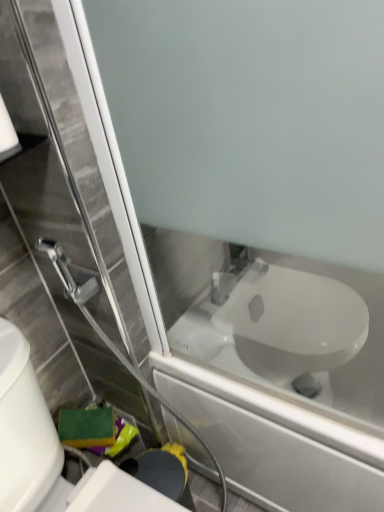
Find the location of a particular element. The image size is (384, 512). white glossy toilet at center is located at coordinates (277, 372).

Looking at this image, from the image's perspective, which one is positioned lower, white glossy toilet at lower right or white matte toilet paper at upper left?

white glossy toilet at lower right, from the image's perspective.

Relative to white matte toilet paper at upper left, is white glossy toilet at lower right in front or behind?

In the image, white glossy toilet at lower right appears in front of white matte toilet paper at upper left.

Is white glossy toilet at lower right inside or outside of white matte toilet paper at upper left?

white glossy toilet at lower right exists outside the volume of white matte toilet paper at upper left.

Is point (254, 440) positioned in front of point (28, 348)?

No, (254, 440) is behind (28, 348).

From a real-world perspective, is white glossy toilet at center physically above white glossy toilet at lower right?

Incorrect, from a real-world perspective, white glossy toilet at center is lower than white glossy toilet at lower right.

Consider the image. Which object is positioned more to the right, white glossy toilet at center or white glossy toilet at lower right?

white glossy toilet at center is more to the right.

From the image's perspective, who appears lower, white glossy toilet at center or white glossy toilet at lower right?

white glossy toilet at lower right is shown below in the image.

From a real-world perspective, is white matte toilet paper at upper left on top of white glossy toilet at lower right?

Indeed, from a real-world perspective, white matte toilet paper at upper left stands above white glossy toilet at lower right.

From the image's perspective, is white matte toilet paper at upper left positioned above or below white glossy toilet at lower right?

Based on their image positions, white matte toilet paper at upper left is located above white glossy toilet at lower right.

Does point (7, 136) come in front of point (108, 477)?

Yes, it is in front of point (108, 477).

From the image's perspective, relative to white matte toilet paper at upper left, is white glossy toilet at center above or below?

Based on their image positions, white glossy toilet at center is located beneath white matte toilet paper at upper left.

Is white glossy toilet at center in front of or behind white matte toilet paper at upper left in the image?

Visually, white glossy toilet at center is located behind white matte toilet paper at upper left.

Can you tell me how much white glossy toilet at center and white matte toilet paper at upper left differ in facing direction?

90.5 degrees separate the facing orientations of white glossy toilet at center and white matte toilet paper at upper left.

From a real-world perspective, relative to white glossy toilet at center, is white matte toilet paper at upper left vertically above or below?

In terms of real-world spatial position, white matte toilet paper at upper left is above white glossy toilet at center.

Between point (12, 124) and point (181, 326), which one is positioned behind?

Point (181, 326)

How many degrees apart are the facing directions of white matte toilet paper at upper left and white glossy toilet at center?

The facing directions of white matte toilet paper at upper left and white glossy toilet at center are 90.5 degrees apart.

Considering the relative positions of white matte toilet paper at upper left and white glossy toilet at center in the image provided, is white matte toilet paper at upper left to the right of white glossy toilet at center from the viewer's perspective?

No.

From a real-world perspective, who is located lower, white glossy toilet at lower right or white glossy toilet at center?

white glossy toilet at center, from a real-world perspective.

Considering the relative sizes of white glossy toilet at lower right and white glossy toilet at center in the image provided, is white glossy toilet at lower right bigger than white glossy toilet at center?

No, white glossy toilet at lower right is not bigger than white glossy toilet at center.

Based on the photo, which object is wider, white glossy toilet at lower right or white glossy toilet at center?

With larger width is white glossy toilet at center.

Is white glossy toilet at lower right aimed at white glossy toilet at center?

No, white glossy toilet at lower right is not oriented towards white glossy toilet at center.

Find the location of a particular element. The height and width of the screenshot is (512, 384). toilet paper that is behind the white glossy toilet at lower right is located at coordinates (6, 129).

I want to click on toilet in front of the white glossy toilet at center, so click(x=52, y=450).

Estimate the real-world distances between objects in this image. Which object is closer to white glossy toilet at lower right, white glossy toilet at center or white matte toilet paper at upper left?

white glossy toilet at center.

When comparing their distances from white glossy toilet at center, does white glossy toilet at lower right or white matte toilet paper at upper left seem closer?

white glossy toilet at lower right is closer to white glossy toilet at center.

Looking at the image, which one is located closer to white matte toilet paper at upper left, white glossy toilet at lower right or white glossy toilet at center?

→ white glossy toilet at lower right is positioned closer to the anchor white matte toilet paper at upper left.

When comparing their distances from white matte toilet paper at upper left, does white glossy toilet at center or white glossy toilet at lower right seem further?

Based on the image, white glossy toilet at center appears to be further to white matte toilet paper at upper left.

Looking at the image, which one is located further to white glossy toilet at center, white matte toilet paper at upper left or white glossy toilet at lower right?

white matte toilet paper at upper left is further to white glossy toilet at center.

Which object lies further to the anchor point white glossy toilet at lower right, white matte toilet paper at upper left or white glossy toilet at center?

The object further to white glossy toilet at lower right is white matte toilet paper at upper left.

The height and width of the screenshot is (512, 384). Find the location of `bath between white matte toilet paper at upper left and white glossy toilet at lower right in the up-down direction`. bath between white matte toilet paper at upper left and white glossy toilet at lower right in the up-down direction is located at coordinates (277, 372).